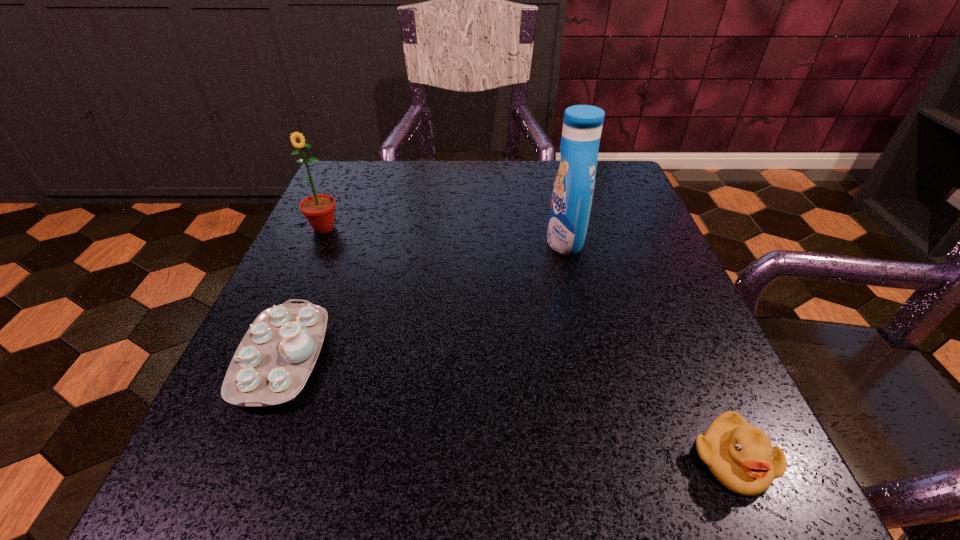
You are a GUI agent. You are given a task and a screenshot of the screen. Output one action in this format:
    pyautogui.click(x=<x>, y=<y>)
    Task: Click on the vacant space located on the back of the chinaware
    
    Given the screenshot: What is the action you would take?
    pyautogui.click(x=322, y=262)

This screenshot has height=540, width=960. Find the location of `object situated at the near edge`. object situated at the near edge is located at coordinates (740, 455).

Identify the location of sunflower present at the left edge. The image size is (960, 540). (319, 210).

Where is `chinaware at the left edge`? chinaware at the left edge is located at coordinates (275, 358).

Find the location of a particular element. The image size is (960, 540). detergent present at the right edge is located at coordinates (573, 188).

Locate an element on the screen. duckling present at the right edge is located at coordinates (740, 455).

Where is `object that is positioned at the near right corner`? Image resolution: width=960 pixels, height=540 pixels. object that is positioned at the near right corner is located at coordinates (740, 455).

Identify the location of free space at the far edge. (509, 202).

This screenshot has width=960, height=540. I want to click on vacant space at the near edge of the desktop, so click(x=438, y=470).

The width and height of the screenshot is (960, 540). I want to click on vacant region at the left edge of the desktop, so click(x=256, y=420).